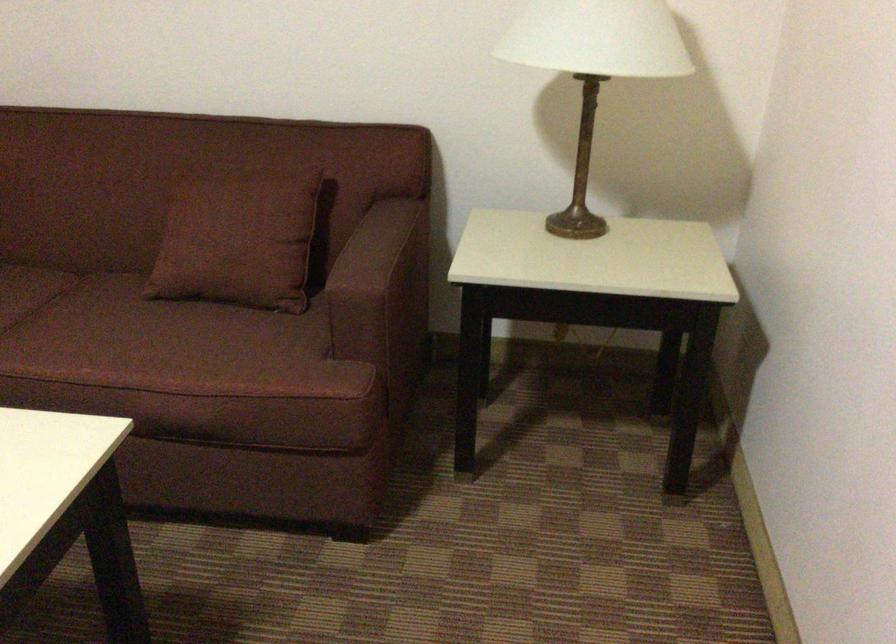
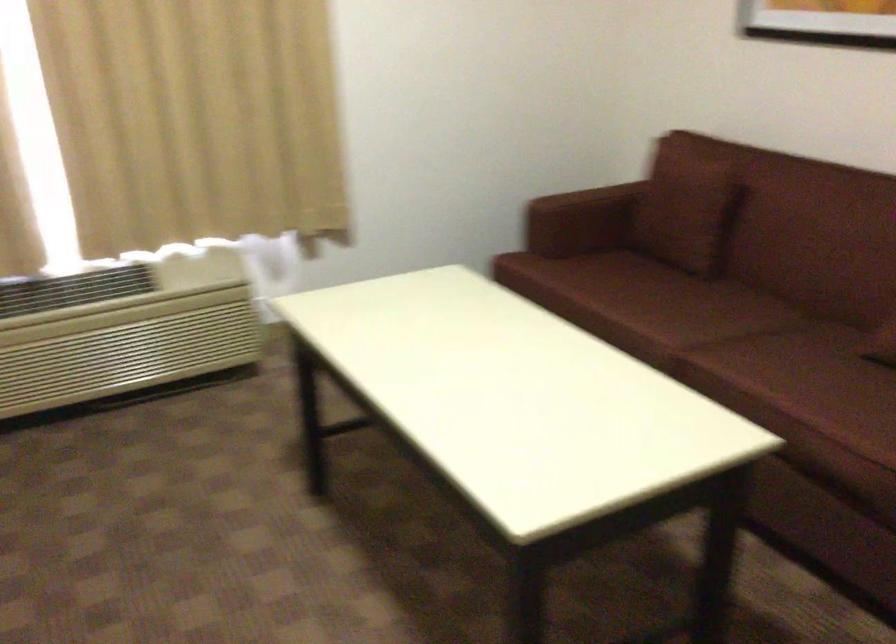
Question: The camera is either moving clockwise (left) or counter-clockwise (right) around the object. The first image is from the beginning of the video and the second image is from the end. Is the camera moving left or right when shooting the video?

Choices:
 (A) Left
 (B) Right

Answer: (B)